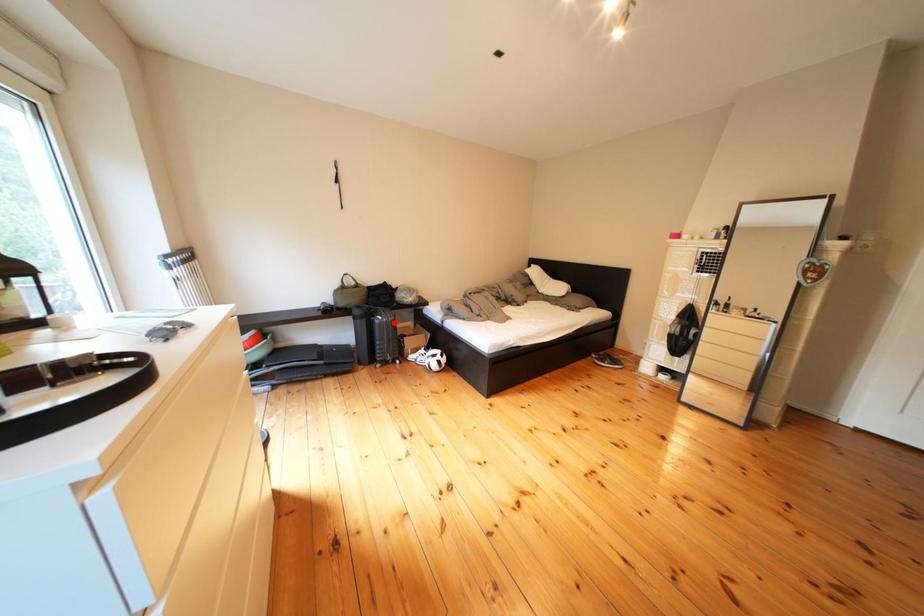
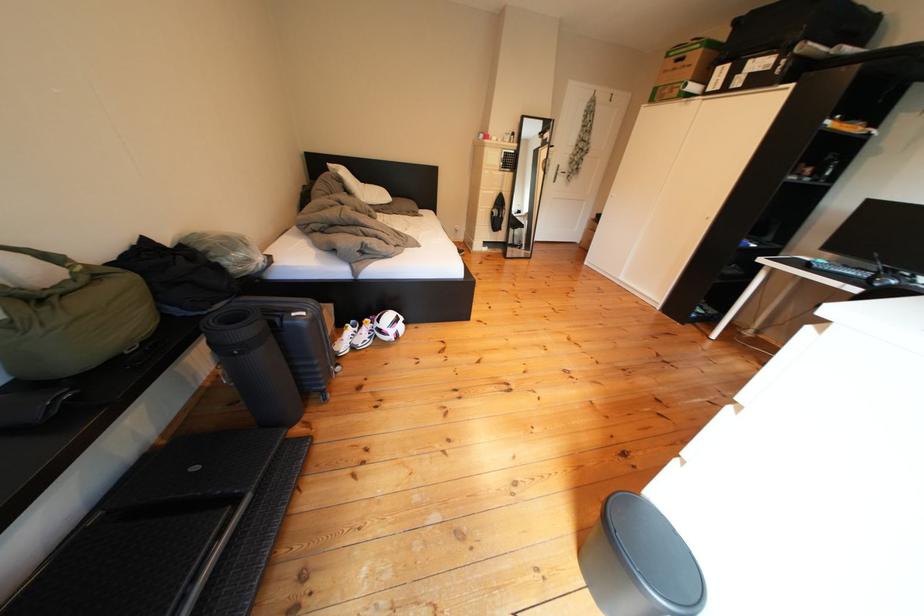
In the second image, find the point that corresponds to the highlighted location in the first image.

(317, 318)